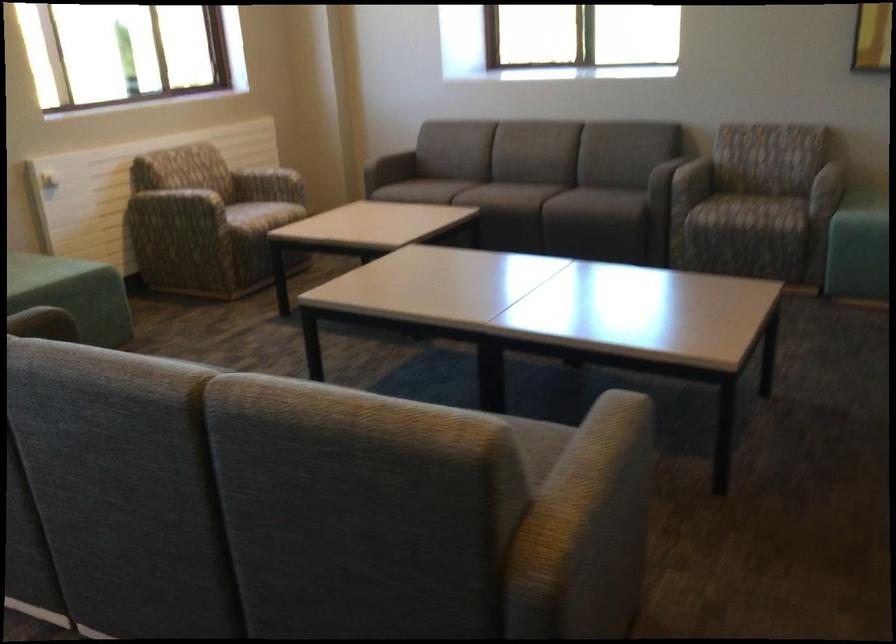
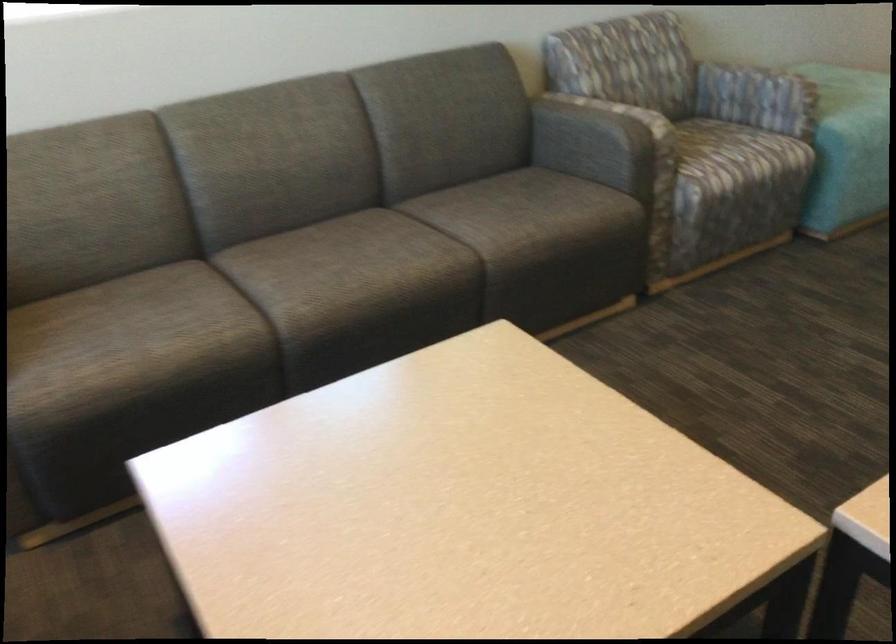
The point at [500,196] is marked in the first image. Where is the corresponding point in the second image?

(427, 269)